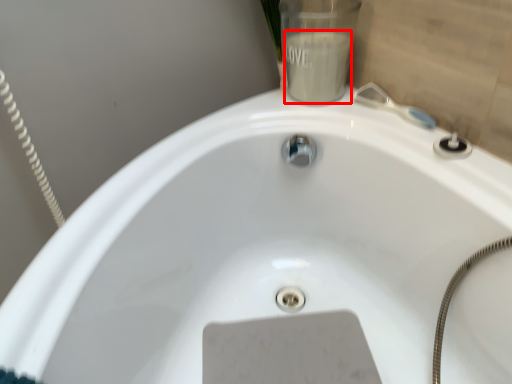
Question: From the image's perspective, considering the relative positions of liquid (annotated by the red box) and plumbing fixture in the image provided, where is liquid (annotated by the red box) located with respect to the staircase?

Choices:
 (A) above
 (B) below

Answer: (A)